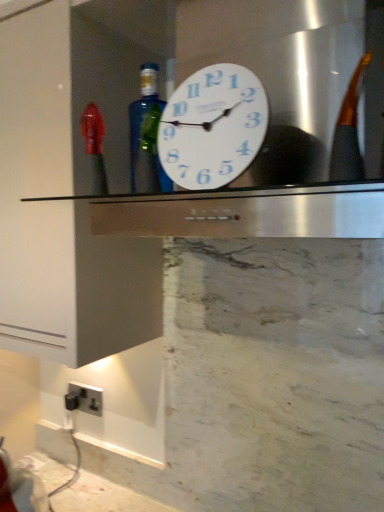
Question: Is satin silver plug socket at lower left situated inside blue glass bottle at center or outside?

Choices:
 (A) outside
 (B) inside

Answer: (A)

Question: Is satin silver plug socket at lower left in front of or behind blue glass bottle at center in the image?

Choices:
 (A) behind
 (B) front

Answer: (A)

Question: Which object is positioned closest to the blue glass bottle at center?

Choices:
 (A) white plastic clock at center
 (B) satin silver plug socket at lower left

Answer: (A)

Question: Which object is positioned closest to the blue glass bottle at center?

Choices:
 (A) satin silver plug socket at lower left
 (B) white plastic clock at center

Answer: (B)